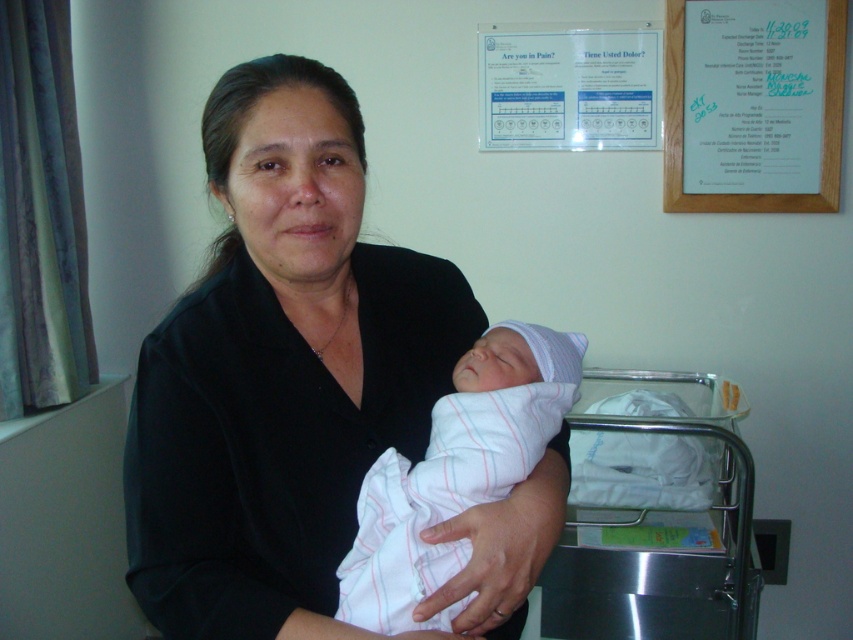
Question: Which point is farther to the camera?

Choices:
 (A) white striped fabric newborn at center
 (B) stainless steel hospital bed at lower right
 (C) black matte shirt at center
 (D) white paper at upper right

Answer: (D)

Question: Is white paper at upper right below white striped fabric newborn at center?

Choices:
 (A) yes
 (B) no

Answer: (B)

Question: Which of the following is the farthest from the observer?

Choices:
 (A) (607, 392)
 (B) (363, 518)
 (C) (686, 172)
 (D) (242, 429)

Answer: (A)

Question: Which object is farther from the camera taking this photo?

Choices:
 (A) white striped fabric newborn at center
 (B) white paper at upper right
 (C) black matte shirt at center
 (D) stainless steel hospital bed at lower right

Answer: (B)

Question: Is stainless steel hospital bed at lower right further to camera compared to white paper at upper right?

Choices:
 (A) no
 (B) yes

Answer: (A)

Question: Does black matte shirt at center have a lesser width compared to stainless steel hospital bed at lower right?

Choices:
 (A) yes
 (B) no

Answer: (A)